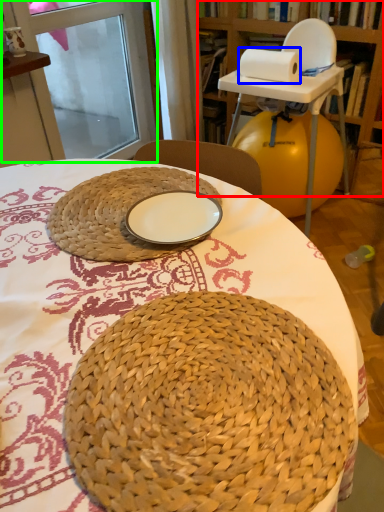
Question: Which object is the farthest from bookshelf (highlighted by a red box)? Choose among these: paper towel (highlighted by a blue box) or screen door (highlighted by a green box).

Choices:
 (A) paper towel
 (B) screen door

Answer: (B)